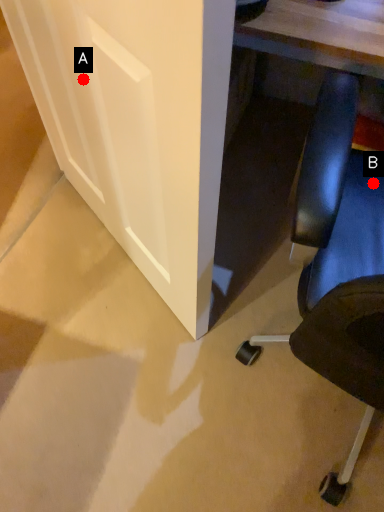
Question: Two points are circled on the image, labeled by A and B beside each circle. Which point is further to the camera?

Choices:
 (A) A is further
 (B) B is further

Answer: (A)